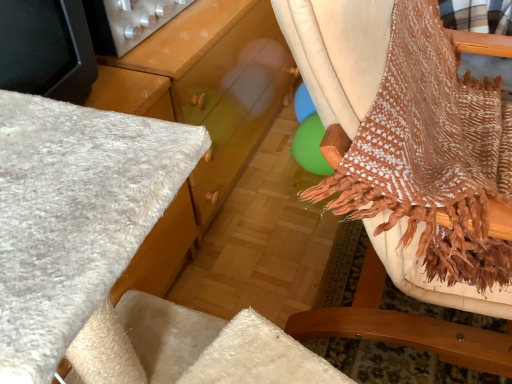
This screenshot has height=384, width=512. What do you see at coordinates (127, 22) in the screenshot?
I see `metallic silver knobs at upper left` at bounding box center [127, 22].

Based on the photo, what is the approximate height of metallic silver knobs at upper left?

metallic silver knobs at upper left is 4.87 inches tall.

What are the coordinates of `metallic silver knobs at upper left` in the screenshot? It's located at (127, 22).

Based on the photo, in order to face brown woven fabric at right, should I rotate leftwards or rightwards?

You should look right and rotate roughly 25.091 degrees.

Find the location of a particular element. brown woven fabric at right is located at coordinates (390, 128).

The width and height of the screenshot is (512, 384). Describe the element at coordinates (390, 128) in the screenshot. I see `brown woven fabric at right` at that location.

This screenshot has width=512, height=384. Find the location of `metallic silver knobs at upper left`. metallic silver knobs at upper left is located at coordinates (127, 22).

Considering the positions of objects metallic silver knobs at upper left and brown woven fabric at right in the image provided, who is more to the right, metallic silver knobs at upper left or brown woven fabric at right?

From the viewer's perspective, brown woven fabric at right appears more on the right side.

Consider the image. Is metallic silver knobs at upper left positioned behind brown woven fabric at right?

Yes, it is.

Which point is more distant from viewer, (96, 51) or (408, 293)?

Point (96, 51)

From the image's perspective, is metallic silver knobs at upper left below brown woven fabric at right?

Incorrect, from the image's perspective, metallic silver knobs at upper left is higher than brown woven fabric at right.

From a real-world perspective, is metallic silver knobs at upper left physically located above or below brown woven fabric at right?

From a real-world perspective, metallic silver knobs at upper left is physically above brown woven fabric at right.

Does metallic silver knobs at upper left have a lesser width compared to brown woven fabric at right?

Yes.

Between metallic silver knobs at upper left and brown woven fabric at right, which one has more height?

brown woven fabric at right.

Is metallic silver knobs at upper left bigger than brown woven fabric at right?

No.

Which is correct: metallic silver knobs at upper left is inside brown woven fabric at right, or outside of it?

metallic silver knobs at upper left cannot be found inside brown woven fabric at right.

Are metallic silver knobs at upper left and brown woven fabric at right far apart?

That's not correct — metallic silver knobs at upper left is a little close to brown woven fabric at right.

From the picture: Is brown woven fabric at right at the back of metallic silver knobs at upper left?

No.

How much distance is there between metallic silver knobs at upper left and brown woven fabric at right?

They are 22.75 inches apart.

Identify the location of chair on the right of metallic silver knobs at upper left. The image size is (512, 384). (390, 128).

Can you confirm if brown woven fabric at right is positioned to the left of metallic silver knobs at upper left?

In fact, brown woven fabric at right is to the right of metallic silver knobs at upper left.

Which object is closer to the camera taking this photo, brown woven fabric at right or metallic silver knobs at upper left?

brown woven fabric at right.

Which is further, (372, 65) or (158, 25)?

Point (158, 25)

From the image's perspective, which one is positioned lower, brown woven fabric at right or metallic silver knobs at upper left?

brown woven fabric at right is shown below in the image.

From a real-world perspective, is brown woven fabric at right on metallic silver knobs at upper left?

No, from a real-world perspective, brown woven fabric at right is not above metallic silver knobs at upper left.

Can you confirm if brown woven fabric at right is thinner than metallic silver knobs at upper left?

Incorrect, the width of brown woven fabric at right is not less than that of metallic silver knobs at upper left.

In terms of height, does brown woven fabric at right look taller or shorter compared to metallic silver knobs at upper left?

brown woven fabric at right is taller than metallic silver knobs at upper left.

Between brown woven fabric at right and metallic silver knobs at upper left, which one has smaller size?

With smaller size is metallic silver knobs at upper left.

Would you say brown woven fabric at right is outside metallic silver knobs at upper left?

Yes.

Are brown woven fabric at right and metallic silver knobs at upper left located far from each other?

No, brown woven fabric at right is in close proximity to metallic silver knobs at upper left.

Is metallic silver knobs at upper left at the back of brown woven fabric at right?

Yes, metallic silver knobs at upper left is at the back of brown woven fabric at right.

Consider the image. Measure the distance from brown woven fabric at right to metallic silver knobs at upper left.

A distance of 22.75 inches exists between brown woven fabric at right and metallic silver knobs at upper left.

The image size is (512, 384). In order to click on chair located underneath the metallic silver knobs at upper left (from a real-world perspective) in this screenshot , I will do `click(390, 128)`.

What are the coordinates of `appliance on the left of brown woven fabric at right` in the screenshot? It's located at point(127,22).

Find the location of `chair to the right of metallic silver knobs at upper left`. chair to the right of metallic silver knobs at upper left is located at coordinates (390, 128).